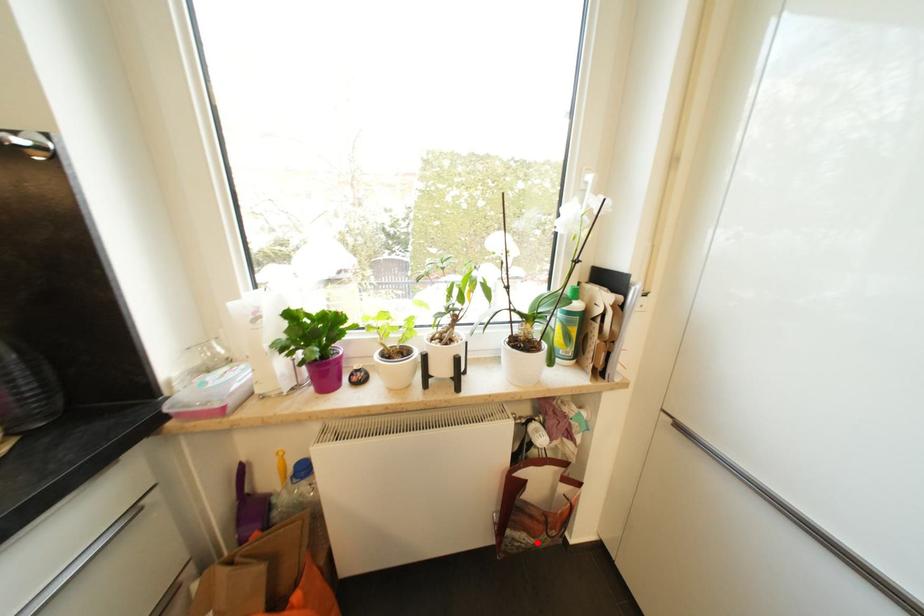
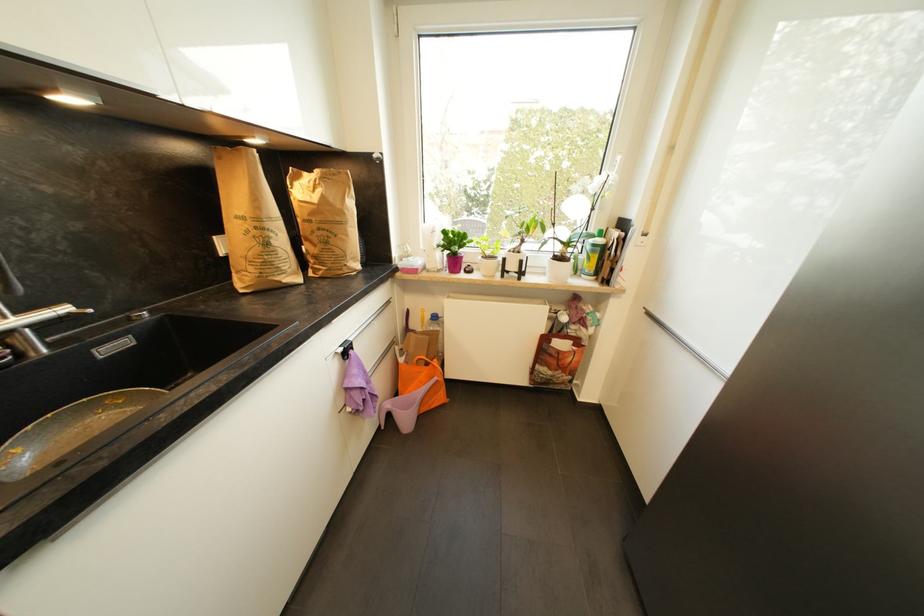
Locate, in the second image, the point that corresponds to the highlighted location in the first image.

(554, 375)